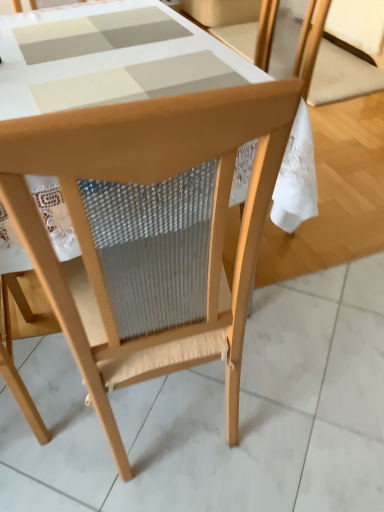
Question: From a real-world perspective, is wooden chair at upper right, placed as the 1th chair when sorted from back to front, above or below natural wood chair at center, the 1th chair in the front-to-back sequence?

Choices:
 (A) below
 (B) above

Answer: (A)

Question: Is point (364, 56) positioned closer to the camera than point (99, 161)?

Choices:
 (A) closer
 (B) farther

Answer: (B)

Question: Relative to natural wood chair at center, marked as the 2th chair in a top-to-bottom arrangement, is wooden chair at upper right, placed as the 1th chair when sorted from top to bottom, in front or behind?

Choices:
 (A) front
 (B) behind

Answer: (B)

Question: Is natural wood chair at center, marked as the 2th chair in a top-to-bottom arrangement, taller or shorter than wooden chair at upper right, placed as the 1th chair when sorted from back to front?

Choices:
 (A) short
 (B) tall

Answer: (B)

Question: Is natural wood chair at center, marked as the 2th chair in a top-to-bottom arrangement, to the left or to the right of wooden chair at upper right, placed as the 1th chair when sorted from top to bottom, in the image?

Choices:
 (A) left
 (B) right

Answer: (A)

Question: From the image's perspective, relative to wooden chair at upper right, positioned as the first chair in right-to-left order, is natural wood chair at center, which appears as the 1th chair when ordered from the bottom, above or below?

Choices:
 (A) above
 (B) below

Answer: (B)

Question: Looking at the image, does natural wood chair at center, the 1th chair in the front-to-back sequence, seem bigger or smaller compared to wooden chair at upper right, placed as the 1th chair when sorted from back to front?

Choices:
 (A) big
 (B) small

Answer: (A)